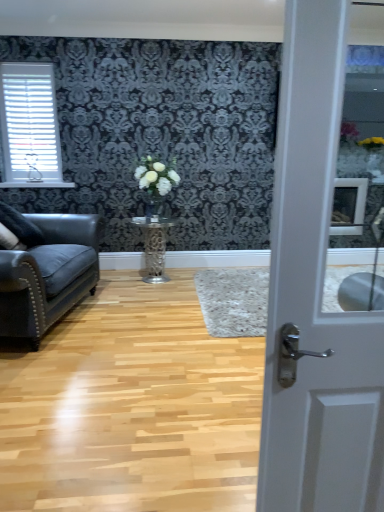
Question: From the image's perspective, is white glossy door at center positioned above or below leather couch at left?

Choices:
 (A) below
 (B) above

Answer: (A)

Question: From a real-world perspective, is white glossy door at center above or below leather couch at left?

Choices:
 (A) above
 (B) below

Answer: (A)

Question: Which object is the farthest from the white glossy vase at center?

Choices:
 (A) white plastic blinds at upper left
 (B) wooden floor at center
 (C) metallic silver table at center
 (D) black faux fur pillow at left
 (E) leather couch at left

Answer: (B)

Question: Which object is positioned farthest from the metallic silver table at center?

Choices:
 (A) leather couch at left
 (B) white glossy vase at center
 (C) wooden floor at center
 (D) white glossy door at center
 (E) white plastic blinds at upper left

Answer: (D)